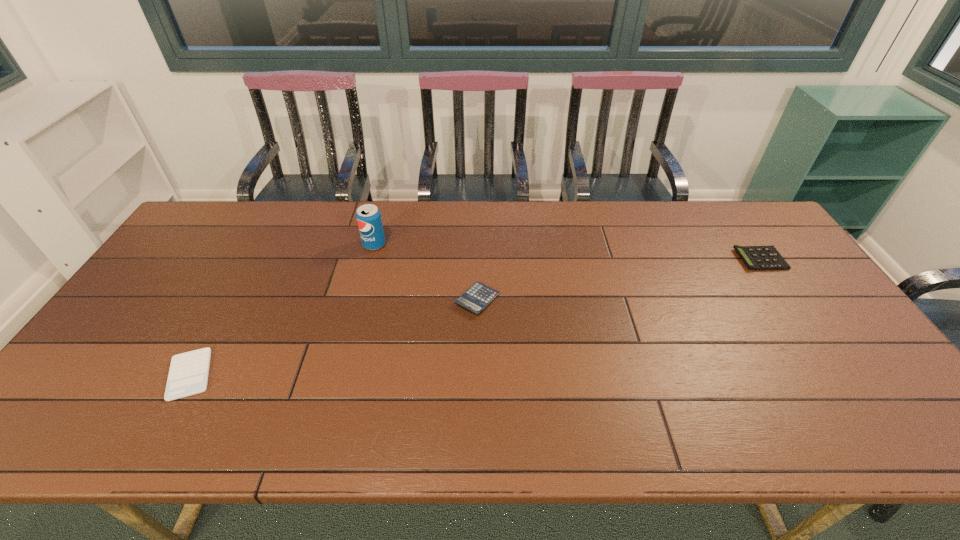
Image resolution: width=960 pixels, height=540 pixels. Find the location of `the second object from left to right`. the second object from left to right is located at coordinates click(368, 216).

Locate an element on the screen. This screenshot has height=540, width=960. soda can is located at coordinates (368, 216).

Identify the location of the second object from right to left. The width and height of the screenshot is (960, 540). (478, 296).

Where is `the third farthest object`? The image size is (960, 540). the third farthest object is located at coordinates (478, 296).

The width and height of the screenshot is (960, 540). Identify the location of the farthest calculator. (759, 258).

Locate an element on the screen. The image size is (960, 540). the rightmost object is located at coordinates (759, 258).

This screenshot has height=540, width=960. Find the location of `the shortest object`. the shortest object is located at coordinates (188, 375).

Where is `the leftmost calculator`? The width and height of the screenshot is (960, 540). the leftmost calculator is located at coordinates (188, 375).

Identify the location of free location located 0.100m on the front of the soda can. (367, 274).

Where is `free space located on the left of the third object from left to right`? The image size is (960, 540). free space located on the left of the third object from left to right is located at coordinates (383, 300).